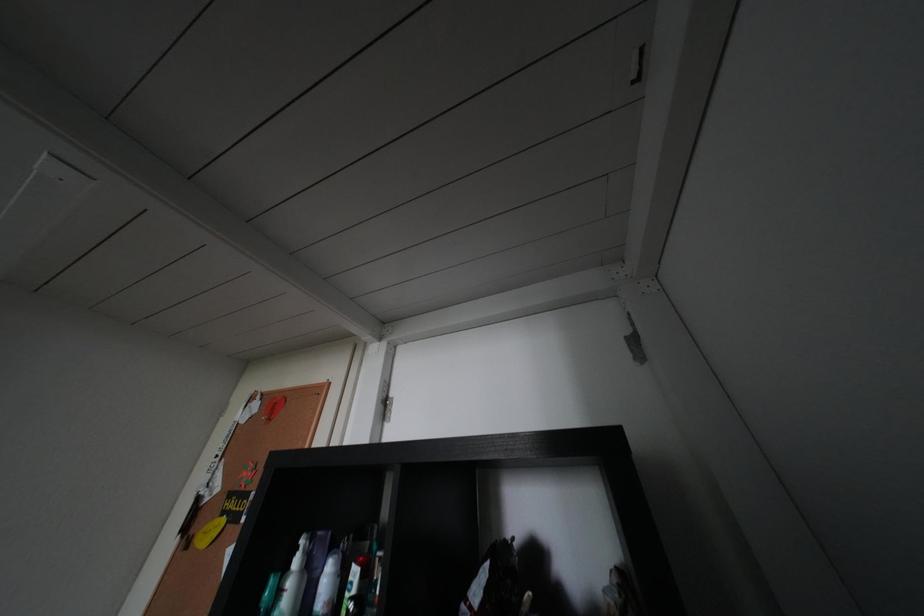
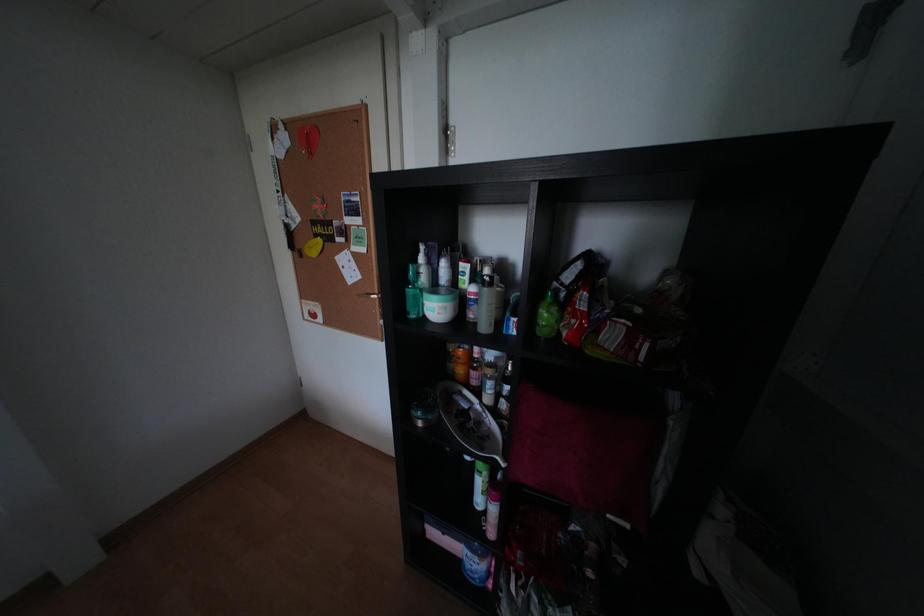
Question: How did the camera likely rotate?

Choices:
 (A) Left
 (B) Right
 (C) Up
 (D) Down

Answer: (D)